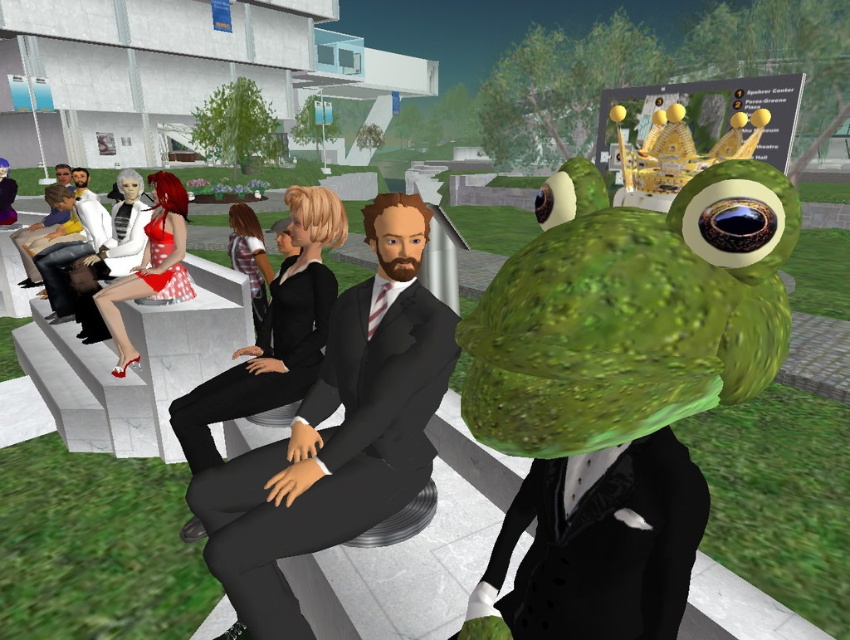
You are organizing a fashion show and need to decide which outfit to feature first. Both the black suit at center and the black matte suit at center are available. Based on their visual characteristics, which one would you choose if you want to highlight a wider silhouette?

The black suit at center is wider than the black matte suit at center, so it would be the better choice to highlight a wider silhouette.